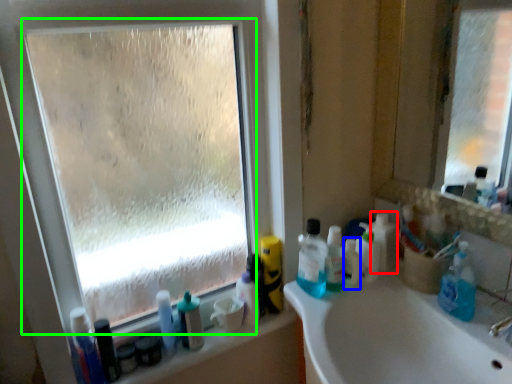
Question: Which object is positioned closest to toiletry (highlighted by a red box)? Select from mouthwash (highlighted by a blue box) and glass window (highlighted by a green box).

Choices:
 (A) mouthwash
 (B) glass window

Answer: (A)